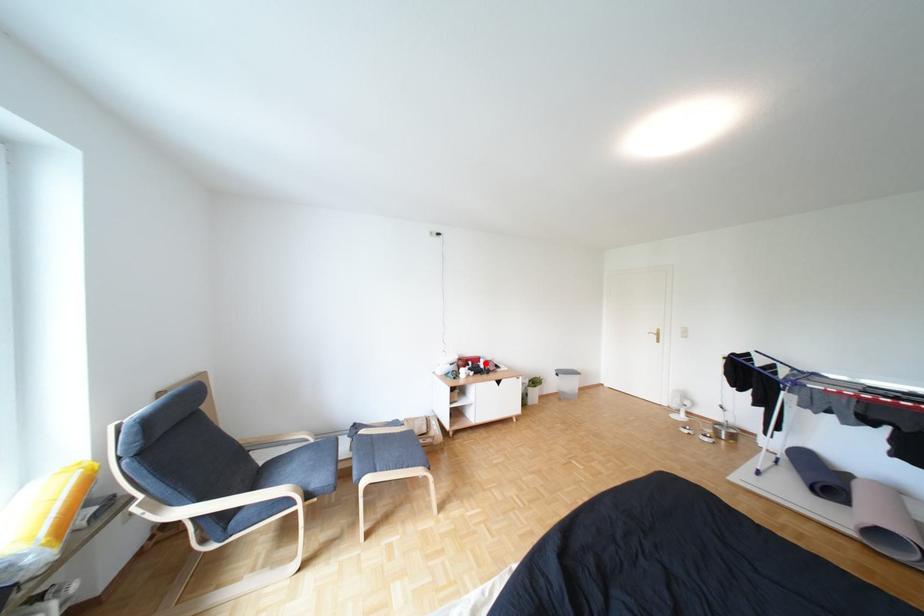
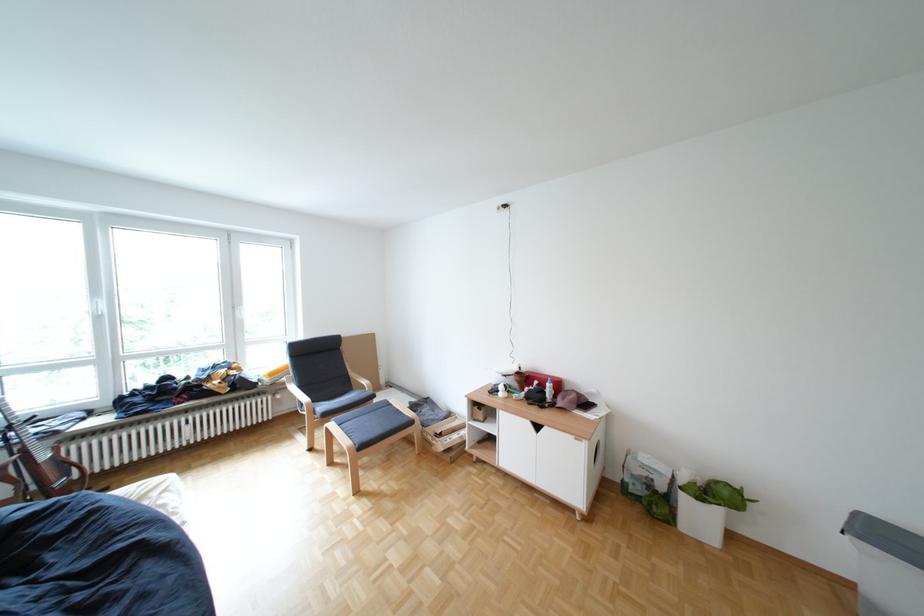
Find the pixel in the second image that matches the highlighted location in the first image.

(552, 383)